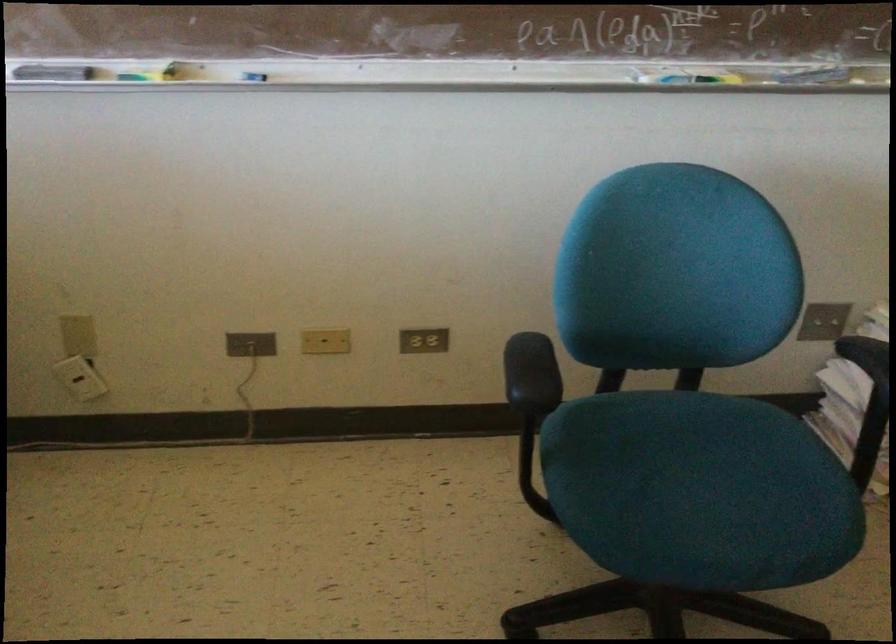
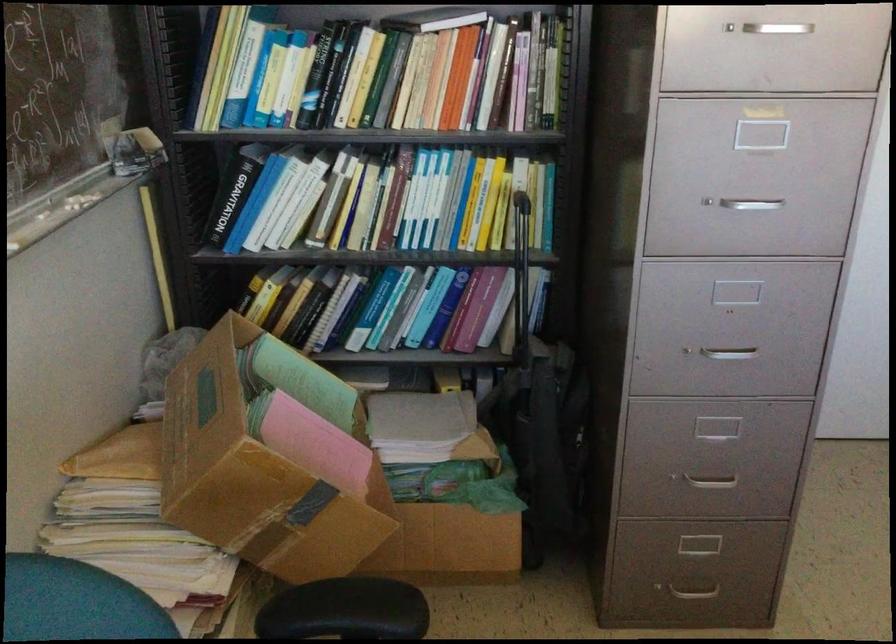
First-person continuous shooting, in which direction is the camera rotating?

The camera rotated toward right-down.